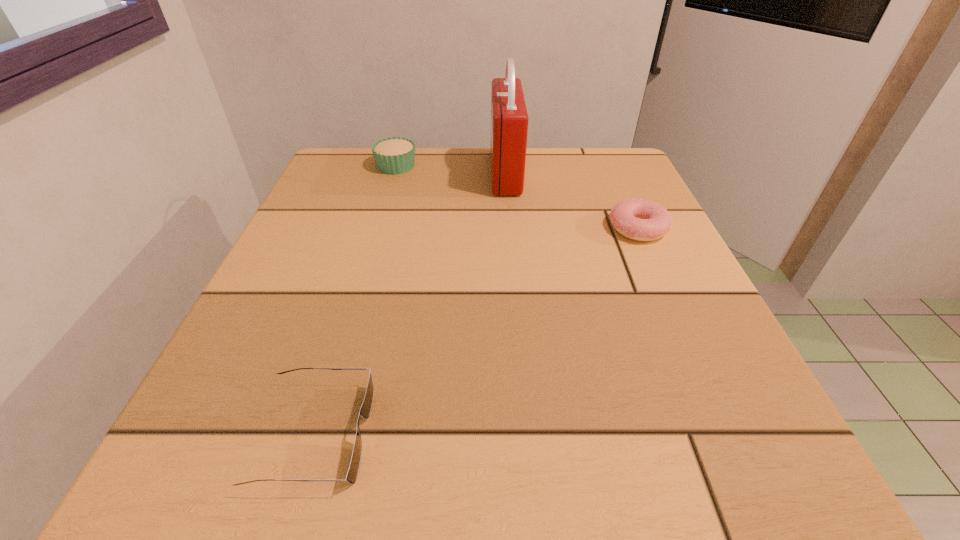
Identify the location of blank space that satisfies the following two spatial constraints: 1. on the front side of the second nearest object; 2. on the right side of the cupcake. Image resolution: width=960 pixels, height=540 pixels. (378, 228).